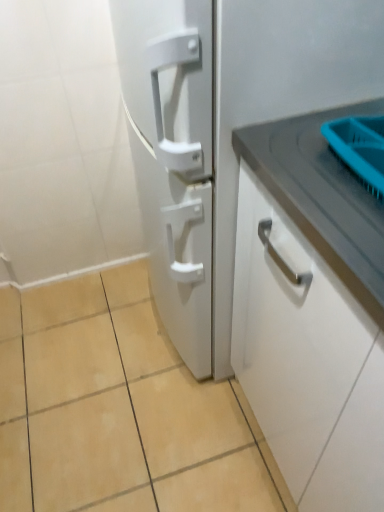
You are a GUI agent. You are given a task and a screenshot of the screen. Output one action in this format:
    pyautogui.click(x=<x>, y=<y>)
    Task: Click on the free point above beige ceramic tile at lower center (from a real-world perspective)
    
    Given the screenshot: What is the action you would take?
    pyautogui.click(x=110, y=382)